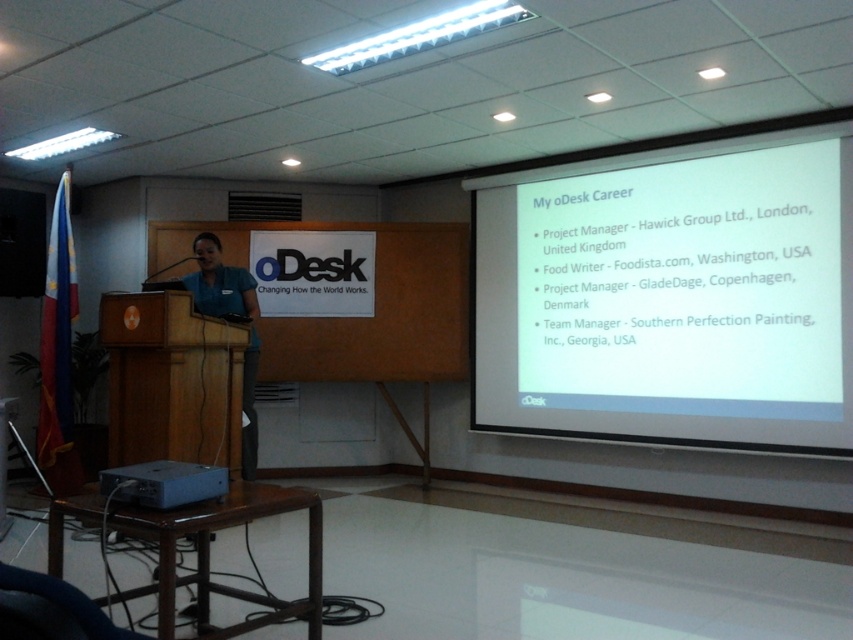
You are an event organizer setting up a presentation. You need to position a new speaker who will stand near the gray metallic projector at lower left. Where should the speaker stand relative to the white matte projector screen at upper right?

The speaker should stand to the left of the white matte projector screen at upper right because the gray metallic projector at lower left is positioned to the left of the screen.

You are an event planner setting up a new projector in the room. The projector needs to be placed at a position that is directly to the left of the point labeled as point (670,296). Where should you position the projector?

The point labeled (670,296) corresponds to the white matte projector screen at upper right. Therefore, the projector should be positioned to the left of the white matte projector screen at upper right.